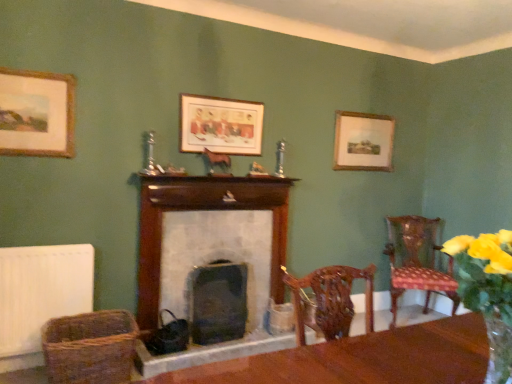
Question: From the image's perspective, is polka dot fabric chair at right below wooden picture frame at upper right, the third picture frame positioned from the front?

Choices:
 (A) no
 (B) yes

Answer: (B)

Question: From the image's perspective, does polka dot fabric chair at right appear higher than wooden picture frame at upper right, the third picture frame positioned from the front?

Choices:
 (A) no
 (B) yes

Answer: (A)

Question: Does polka dot fabric chair at right have a greater height compared to wooden picture frame at upper right, the 1th picture frame when ordered from right to left?

Choices:
 (A) yes
 (B) no

Answer: (A)

Question: Does polka dot fabric chair at right have a smaller size compared to wooden picture frame at upper right, the 1th picture frame when ordered from right to left?

Choices:
 (A) no
 (B) yes

Answer: (A)

Question: From a real-world perspective, does polka dot fabric chair at right stand above wooden picture frame at upper right, the 1th picture frame when ordered from right to left?

Choices:
 (A) no
 (B) yes

Answer: (A)

Question: From a real-world perspective, does polka dot fabric chair at right sit lower than wooden picture frame at upper right, the third picture frame viewed from the left?

Choices:
 (A) no
 (B) yes

Answer: (B)

Question: Is the position of wooden picture frame at upper right, placed as the 1th picture frame when sorted from back to front, more distant than that of white matte radiator at lower left?

Choices:
 (A) yes
 (B) no

Answer: (A)

Question: From a real-world perspective, is wooden picture frame at upper right, the third picture frame viewed from the left, over white matte radiator at lower left?

Choices:
 (A) no
 (B) yes

Answer: (B)

Question: From the image's perspective, is wooden picture frame at upper right, the third picture frame positioned from the front, above white matte radiator at lower left?

Choices:
 (A) no
 (B) yes

Answer: (B)

Question: Is the surface of wooden picture frame at upper right, the 1th picture frame when ordered from right to left, in direct contact with white matte radiator at lower left?

Choices:
 (A) yes
 (B) no

Answer: (B)

Question: Considering the relative sizes of wooden picture frame at upper right, placed as the 1th picture frame when sorted from back to front, and white matte radiator at lower left in the image provided, is wooden picture frame at upper right, placed as the 1th picture frame when sorted from back to front, bigger than white matte radiator at lower left?

Choices:
 (A) no
 (B) yes

Answer: (A)

Question: Is wooden picture frame at upper right, the third picture frame viewed from the left, wider than white matte radiator at lower left?

Choices:
 (A) no
 (B) yes

Answer: (A)

Question: Would you say yellow fabric flower at right is outside woven brown basket at lower left?

Choices:
 (A) no
 (B) yes

Answer: (B)